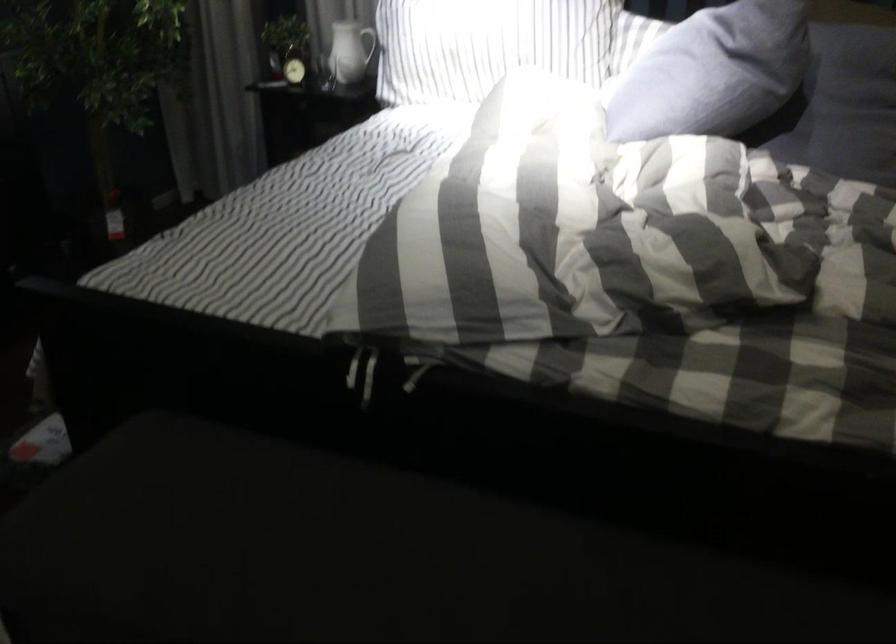
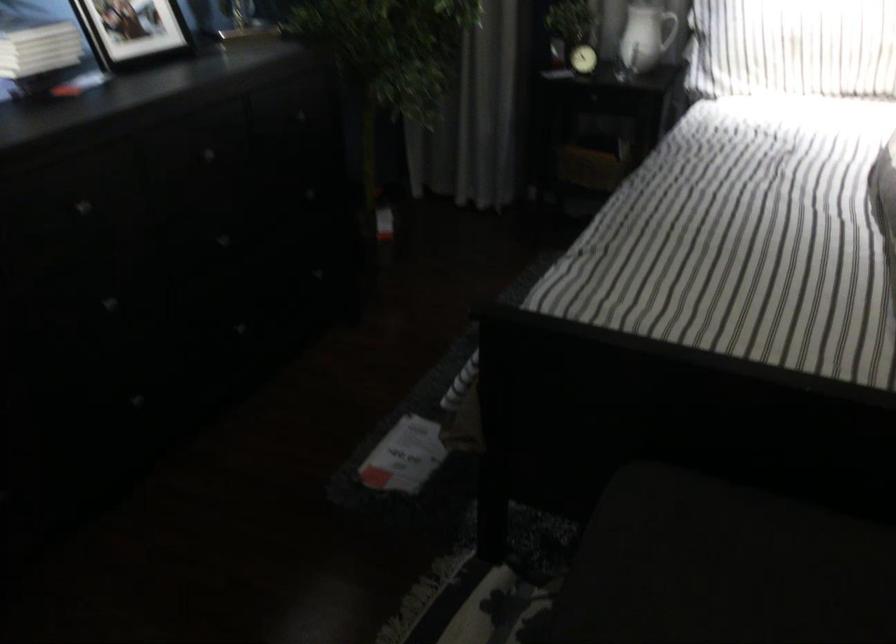
Question: Based on the continuous images, in which direction is the camera rotating? Reply with the corresponding letter.

Choices:
 (A) Left
 (B) Right
 (C) Up
 (D) Down

Answer: (A)